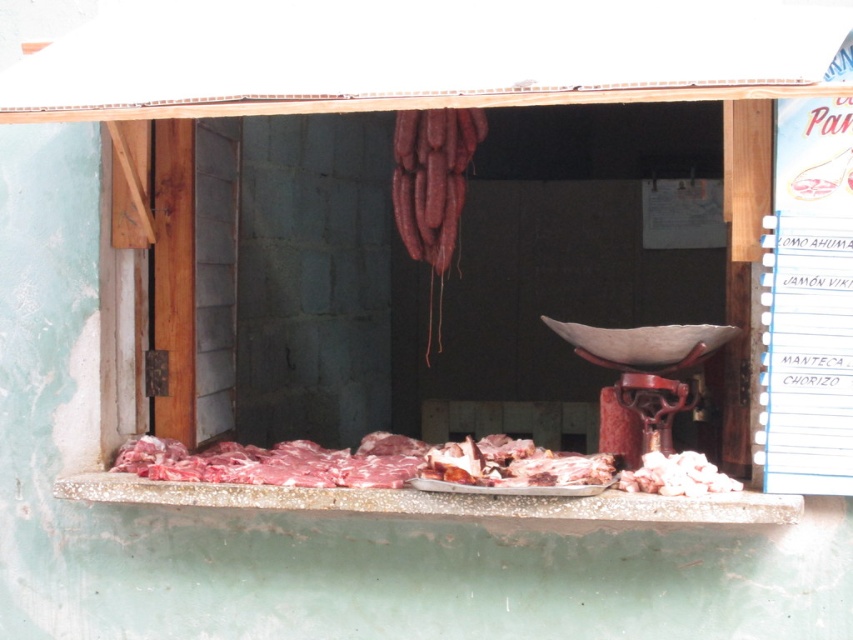
Is smooth concrete meat at center shorter than pink raw meat at lower right?

In fact, smooth concrete meat at center may be taller than pink raw meat at lower right.

Does smooth concrete meat at center have a smaller size compared to pink raw meat at lower right?

Incorrect, smooth concrete meat at center is not smaller in size than pink raw meat at lower right.

The height and width of the screenshot is (640, 853). What do you see at coordinates (437, 500) in the screenshot?
I see `smooth concrete meat at center` at bounding box center [437, 500].

Locate an element on the screen. The image size is (853, 640). smooth concrete meat at center is located at coordinates (437, 500).